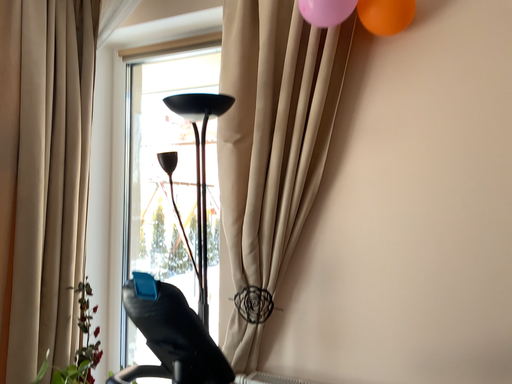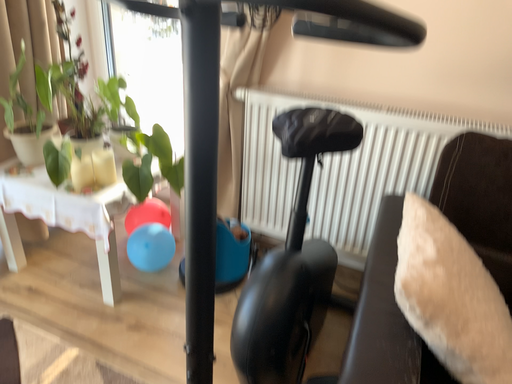
Question: How did the camera likely rotate when shooting the video?

Choices:
 (A) rotated upward
 (B) rotated downward

Answer: (B)